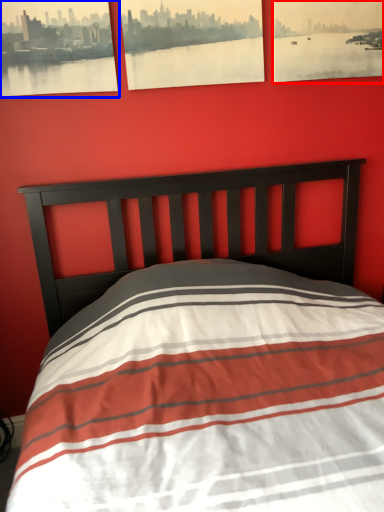
Question: Which of the following is the closest to the observer, picture frame (highlighted by a red box) or picture frame (highlighted by a blue box)?

Choices:
 (A) picture frame
 (B) picture frame

Answer: (B)